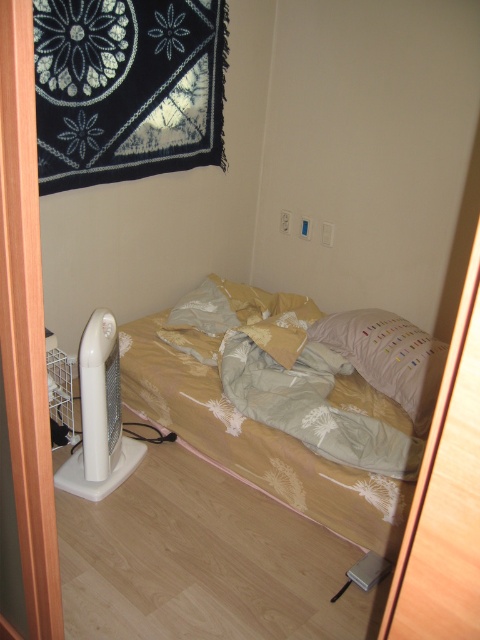
Question: Does white soft pillow at upper right have a lesser width compared to white plastic fan at lower left?

Choices:
 (A) no
 (B) yes

Answer: (A)

Question: Which object is farther from the camera taking this photo?

Choices:
 (A) white plastic fan at lower left
 (B) white soft pillow at upper right
 (C) light beige floral fabric at center
 (D) light beige fabric bed at center

Answer: (B)

Question: Which object is positioned farthest from the light beige fabric bed at center?

Choices:
 (A) light beige floral fabric at center
 (B) white soft pillow at upper right
 (C) white plastic fan at lower left

Answer: (C)

Question: Which object appears closest to the camera in this image?

Choices:
 (A) white soft pillow at upper right
 (B) white plastic fan at lower left
 (C) light beige fabric bed at center
 (D) light beige floral fabric at center

Answer: (C)

Question: Can you confirm if light beige fabric bed at center is positioned above light beige floral fabric at center?

Choices:
 (A) no
 (B) yes

Answer: (B)

Question: Is light beige floral fabric at center further to the viewer compared to white soft pillow at upper right?

Choices:
 (A) yes
 (B) no

Answer: (B)